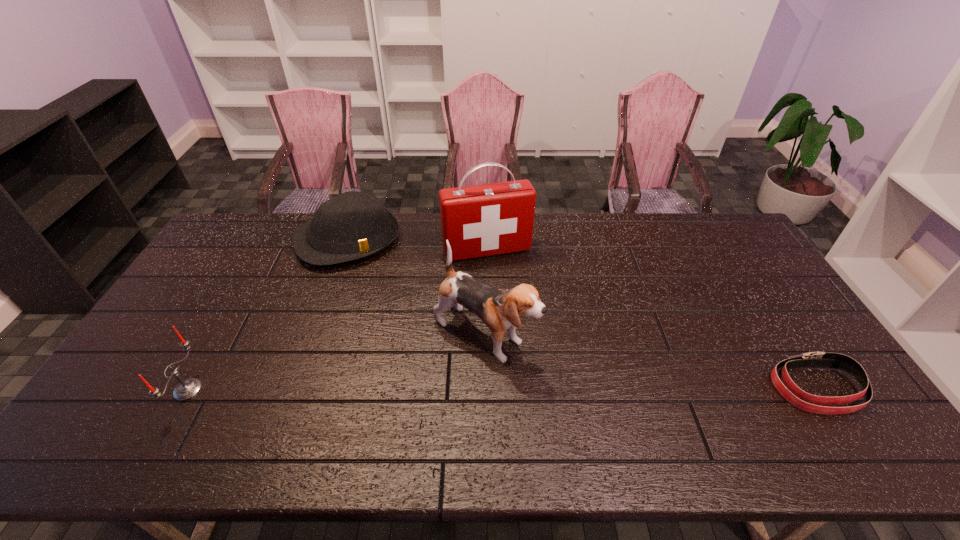
At what (x,y) coordinates should I click in order to perform the action: click on candle. Please return your answer as a coordinate pair (x, y). The width and height of the screenshot is (960, 540). Looking at the image, I should click on (187, 389).

I want to click on the shortest object, so click(x=800, y=399).

Locate an element on the screen. This screenshot has height=540, width=960. the rightmost object is located at coordinates (800, 399).

The image size is (960, 540). Identify the location of the first-aid kit. (483, 220).

Find the location of `the second object from left to right`. the second object from left to right is located at coordinates (352, 225).

Where is `the fourth shortest object`? This screenshot has width=960, height=540. the fourth shortest object is located at coordinates (499, 309).

Identify the location of vacant space located on the front-facing side of the leftmost object. This screenshot has width=960, height=540. (125, 390).

Locate an element on the screen. This screenshot has height=540, width=960. vacant space located 0.130m on the front-facing side of the leftmost object is located at coordinates (125, 390).

Locate an element on the screen. vacant area located 0.060m on the front-facing side of the leftmost object is located at coordinates point(152,390).

Identify the location of vacant space located on the back of the dog collar. The height and width of the screenshot is (540, 960). (757, 295).